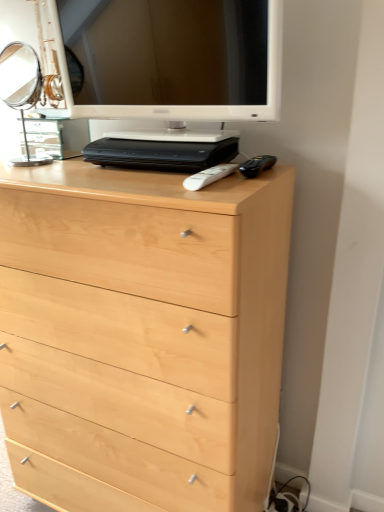
The width and height of the screenshot is (384, 512). Find the location of `free location to the right of polished silver mirror at upper left`. free location to the right of polished silver mirror at upper left is located at coordinates (68, 166).